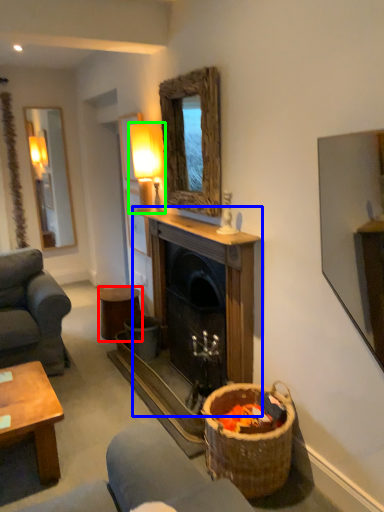
Question: Based on their relative distances, which object is nearer to stool (highlighted by a red box)? Choose from fireplace (highlighted by a blue box) and lamp (highlighted by a green box).

Choices:
 (A) fireplace
 (B) lamp

Answer: (A)